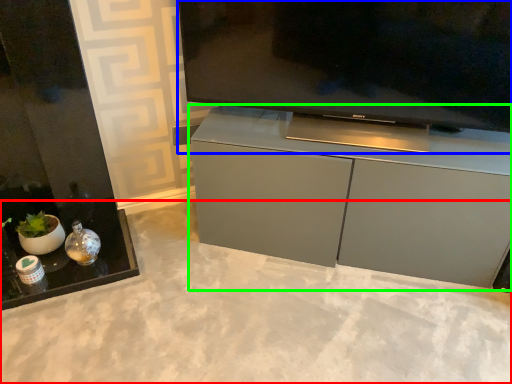
Question: Which object is positioned farthest from concrete (highlighted by a red box)? Select from television (highlighted by a blue box) and cabinetry (highlighted by a green box).

Choices:
 (A) television
 (B) cabinetry

Answer: (A)